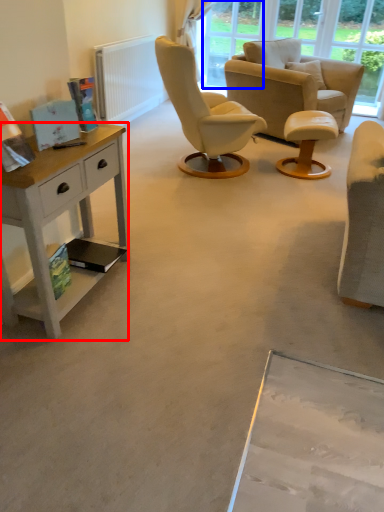
Question: Which object appears farthest to the camera in this image, desk (highlighted by a red box) or window screen (highlighted by a blue box)?

Choices:
 (A) desk
 (B) window screen

Answer: (B)